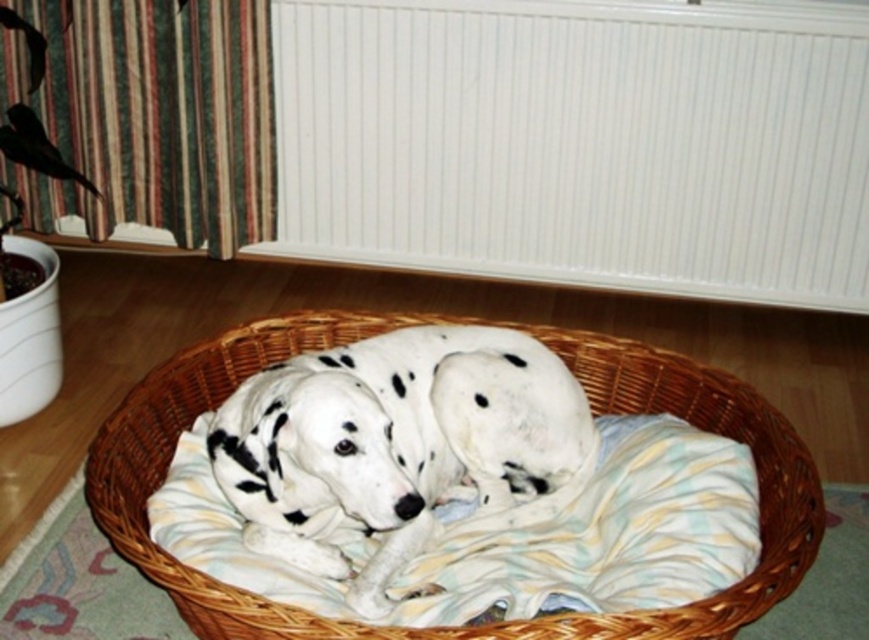
Question: Which object is the closest to the woven wood basket at center?

Choices:
 (A) white plastic radiator at upper center
 (B) white-spotted fur at center

Answer: (B)

Question: Does white plastic radiator at upper center appear on the right side of woven wood basket at center?

Choices:
 (A) yes
 (B) no

Answer: (A)

Question: Which object is the farthest from the white plastic radiator at upper center?

Choices:
 (A) woven wood basket at center
 (B) white-spotted fur at center

Answer: (B)

Question: In this image, where is white plastic radiator at upper center located relative to woven wood basket at center?

Choices:
 (A) right
 (B) left

Answer: (A)

Question: Can you confirm if white-spotted fur at center is positioned to the left of woven wood basket at center?

Choices:
 (A) no
 (B) yes

Answer: (B)

Question: Which point is closer to the camera taking this photo?

Choices:
 (A) (481, 362)
 (B) (423, 204)
 (C) (740, 404)

Answer: (A)